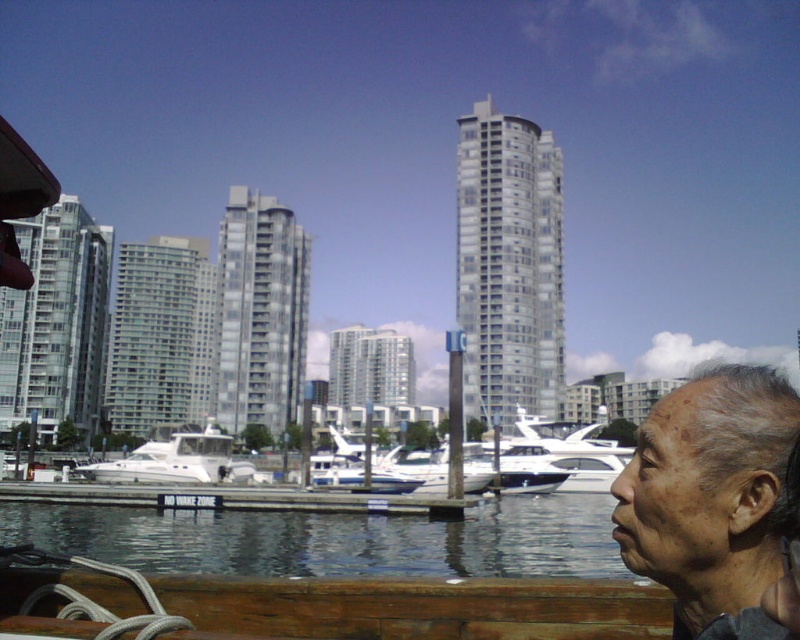
Can you confirm if gray hair at lower right is positioned above white wood dock at lower center?

Yes, gray hair at lower right is above white wood dock at lower center.

Which is behind, point (754, 369) or point (354, 496)?

The point (354, 496) is more distant.

Is point (732, 388) farther from camera compared to point (58, 488)?

No.

At what (x,y) coordinates should I click in order to perform the action: click on gray hair at lower right. Please return your answer as a coordinate pair (x, y). Looking at the image, I should click on (710, 497).

I want to click on clear water at lower left, so click(x=333, y=540).

Which is more to the right, clear water at lower left or white wood dock at lower center?

Positioned to the right is clear water at lower left.

Who is more forward, [326,563] or [444,509]?

Point [326,563] is in front.

Find the location of a particular element. The height and width of the screenshot is (640, 800). clear water at lower left is located at coordinates (333, 540).

This screenshot has height=640, width=800. What do you see at coordinates (236, 499) in the screenshot?
I see `white wood dock at lower center` at bounding box center [236, 499].

Does white wood dock at lower center have a greater height compared to white glossy boat at center?

Incorrect, white wood dock at lower center's height is not larger of white glossy boat at center's.

Between point (110, 497) and point (204, 449), which one is positioned behind?

The point (204, 449) is more distant.

This screenshot has height=640, width=800. Find the location of `white wood dock at lower center`. white wood dock at lower center is located at coordinates (236, 499).